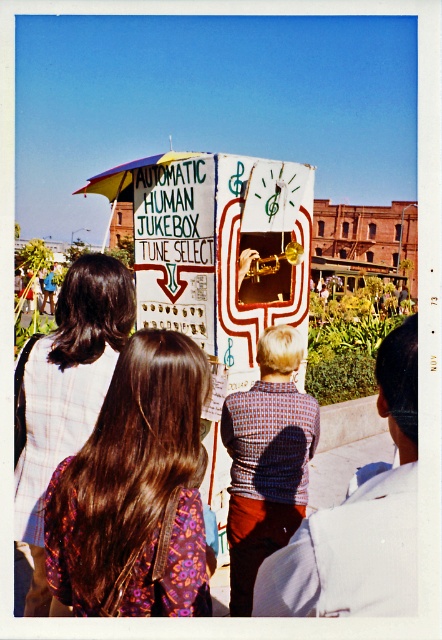
Question: Among these points, which one is farthest from the camera?

Choices:
 (A) (293, 397)
 (B) (46, 337)

Answer: (A)

Question: Is brown hair at center further to the viewer compared to plaid fabric shirt at upper left?

Choices:
 (A) no
 (B) yes

Answer: (A)

Question: Which of the following is the farthest from the observer?

Choices:
 (A) plaid fabric shirt at upper left
 (B) brown hair at center
 (C) knitted sweater at center

Answer: (C)

Question: Can you confirm if brown hair at center is positioned to the left of knitted sweater at center?

Choices:
 (A) yes
 (B) no

Answer: (A)

Question: Does brown hair at center appear on the left side of plaid fabric shirt at upper left?

Choices:
 (A) no
 (B) yes

Answer: (A)

Question: Which point appears closest to the camera in this image?

Choices:
 (A) (33, 612)
 (B) (266, 500)

Answer: (A)